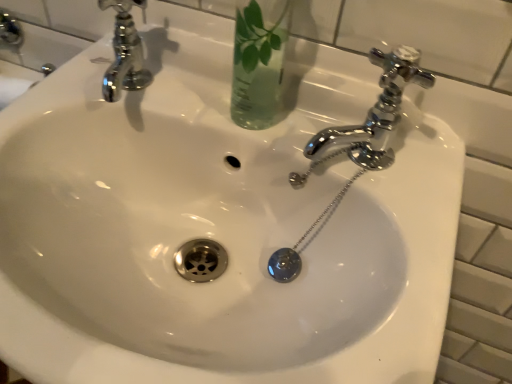
Question: Is transparent glass vase at upper center to the left or to the right of chrome/metallic faucet at right in the image?

Choices:
 (A) left
 (B) right

Answer: (A)

Question: Looking at their shapes, would you say transparent glass vase at upper center is wider or thinner than chrome/metallic faucet at right?

Choices:
 (A) wide
 (B) thin

Answer: (A)

Question: Considering the positions of transparent glass vase at upper center and chrome/metallic faucet at right in the image, is transparent glass vase at upper center taller or shorter than chrome/metallic faucet at right?

Choices:
 (A) short
 (B) tall

Answer: (B)

Question: From the image's perspective, is chrome/metallic faucet at right positioned above or below transparent glass vase at upper center?

Choices:
 (A) above
 (B) below

Answer: (B)

Question: Is point (382, 162) positioned closer to the camera than point (243, 119)?

Choices:
 (A) farther
 (B) closer

Answer: (B)

Question: Based on their positions, is chrome/metallic faucet at right located to the left or right of transparent glass vase at upper center?

Choices:
 (A) left
 (B) right

Answer: (B)

Question: Which is correct: chrome/metallic faucet at right is inside transparent glass vase at upper center, or outside of it?

Choices:
 (A) inside
 (B) outside

Answer: (B)